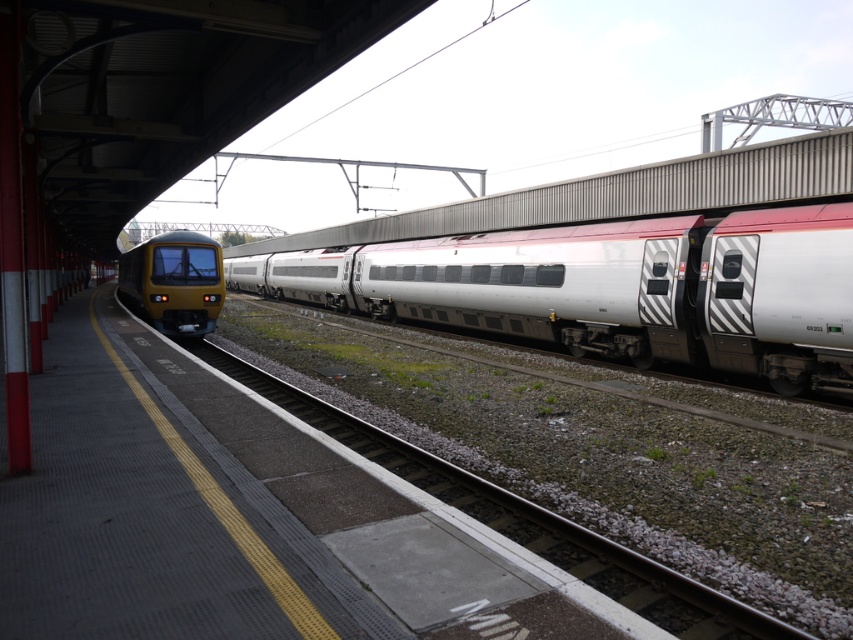
Question: Does silver/white metallic train at center have a lesser width compared to gravel at left?

Choices:
 (A) no
 (B) yes

Answer: (A)

Question: Which object is positioned closest to the gravel at left?

Choices:
 (A) silver/white metallic train at center
 (B) metallic yellow train at left

Answer: (A)

Question: Is gravel at left to the left of metallic yellow train at left from the viewer's perspective?

Choices:
 (A) no
 (B) yes

Answer: (A)

Question: Which of the following is the closest to the observer?

Choices:
 (A) silver/white metallic train at center
 (B) metallic yellow train at left
 (C) gravel at left

Answer: (C)

Question: Is the position of silver/white metallic train at center more distant than that of gravel at left?

Choices:
 (A) no
 (B) yes

Answer: (B)

Question: Which object is the closest to the metallic yellow train at left?

Choices:
 (A) silver/white metallic train at center
 (B) gravel at left

Answer: (A)